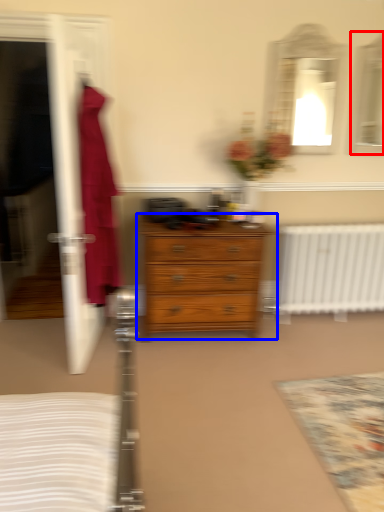
Question: Which object appears farthest to the camera in this image, mirror (highlighted by a red box) or chest of drawers (highlighted by a blue box)?

Choices:
 (A) mirror
 (B) chest of drawers

Answer: (A)